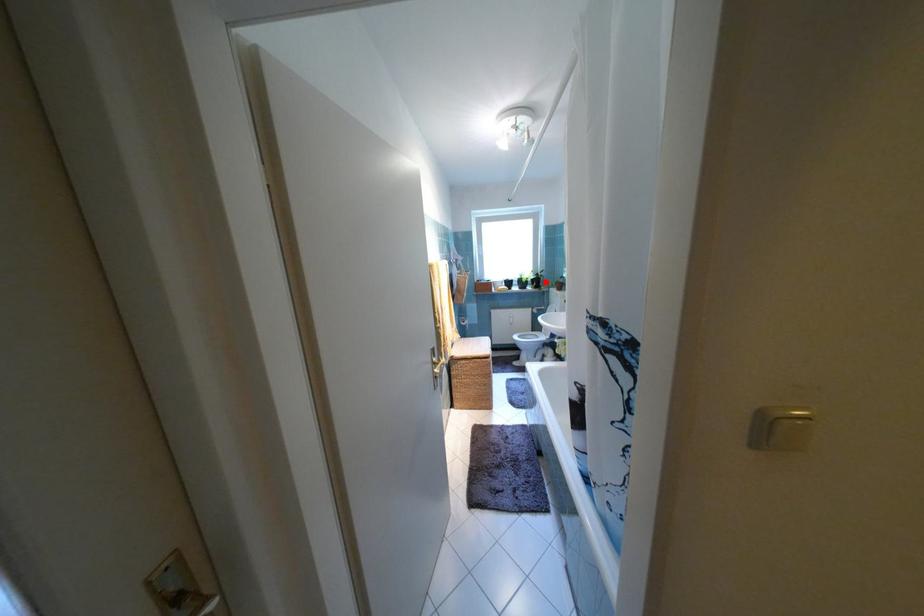
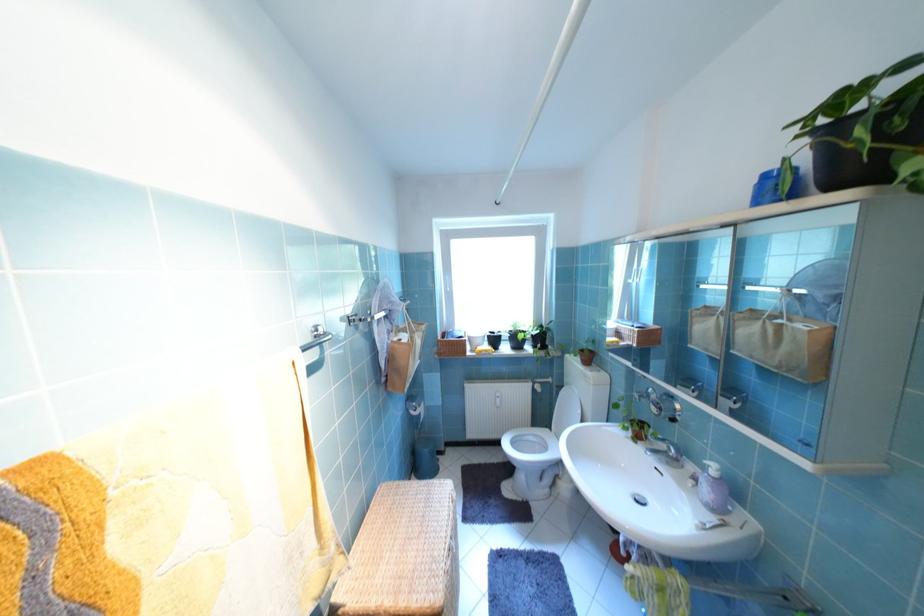
Where in the second image is the point corresponding to the highlighted location from the first image?

(550, 339)